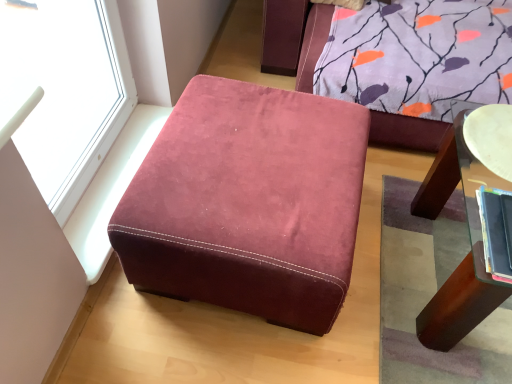
Question: Does white glossy plate at upper right have a larger size compared to hardcover book at right?

Choices:
 (A) no
 (B) yes

Answer: (B)

Question: Considering the relative sizes of white glossy plate at upper right and hardcover book at right in the image provided, is white glossy plate at upper right taller than hardcover book at right?

Choices:
 (A) no
 (B) yes

Answer: (A)

Question: Is white glossy plate at upper right to the left of hardcover book at right from the viewer's perspective?

Choices:
 (A) yes
 (B) no

Answer: (B)

Question: Does white glossy plate at upper right have a greater width compared to hardcover book at right?

Choices:
 (A) yes
 (B) no

Answer: (A)

Question: Considering the relative sizes of white glossy plate at upper right and hardcover book at right in the image provided, is white glossy plate at upper right thinner than hardcover book at right?

Choices:
 (A) yes
 (B) no

Answer: (B)

Question: Which is correct: suede-like burgundy ottoman at center is inside hardcover book at right, or outside of it?

Choices:
 (A) outside
 (B) inside

Answer: (A)

Question: Considering the positions of point (204, 273) and point (487, 271), is point (204, 273) closer or farther from the camera than point (487, 271)?

Choices:
 (A) farther
 (B) closer

Answer: (A)

Question: In terms of size, does suede-like burgundy ottoman at center appear bigger or smaller than hardcover book at right?

Choices:
 (A) big
 (B) small

Answer: (A)

Question: From a real-world perspective, is suede-like burgundy ottoman at center above or below hardcover book at right?

Choices:
 (A) below
 (B) above

Answer: (A)

Question: Based on their positions, is suede-like burgundy ottoman at center located to the left or right of transparent glass window at upper left?

Choices:
 (A) left
 (B) right

Answer: (B)

Question: Is suede-like burgundy ottoman at center bigger or smaller than transparent glass window at upper left?

Choices:
 (A) small
 (B) big

Answer: (B)

Question: Is suede-like burgundy ottoman at center inside the boundaries of transparent glass window at upper left, or outside?

Choices:
 (A) outside
 (B) inside

Answer: (A)

Question: From a real-world perspective, is suede-like burgundy ottoman at center above or below transparent glass window at upper left?

Choices:
 (A) above
 (B) below

Answer: (B)

Question: In terms of width, does white glossy plate at upper right look wider or thinner when compared to hardcover book at right?

Choices:
 (A) thin
 (B) wide

Answer: (B)

Question: Is white glossy plate at upper right to the left or to the right of hardcover book at right in the image?

Choices:
 (A) left
 (B) right

Answer: (B)